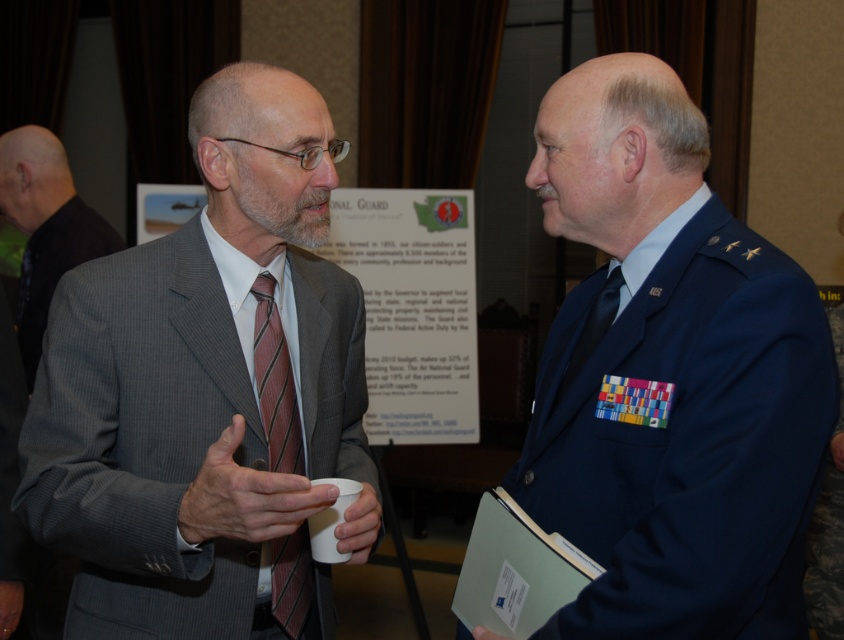
You are a photographer at the event and need to position yourself to capture both the gray textured suit at left and the dark blue military uniform on the right in the same frame. Given that your camera has a limited field of view, which direction should you move to ensure both are visible?

You should move to the center between the gray textured suit at left and the dark blue military uniform on the right to ensure both are within the camera frame.

You are a fashion designer observing two men at an event. You notice the matte gray suit at center and the gray textured suit at left. Which one appears taller?

The matte gray suit at center appears taller because it has a greater height compared to the gray textured suit at left.